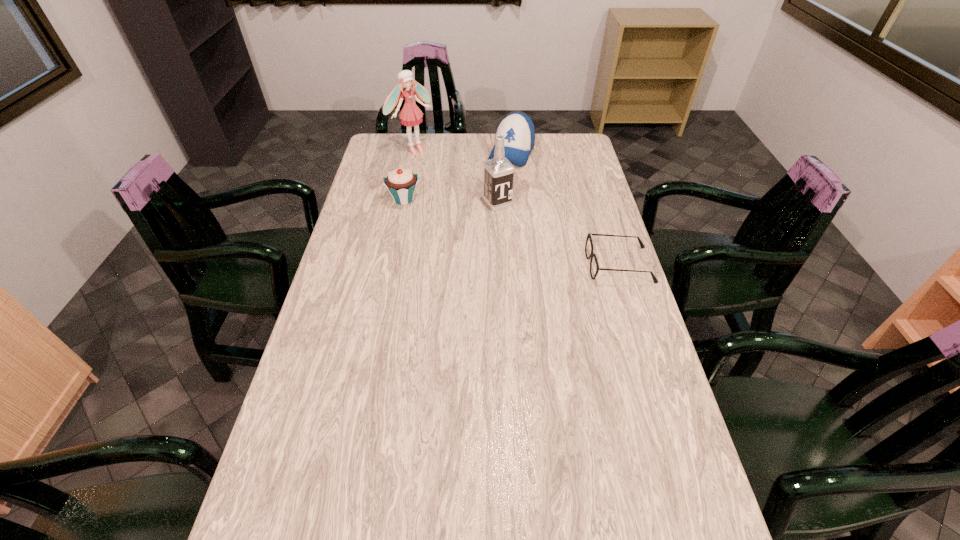
The height and width of the screenshot is (540, 960). What are the coordinates of `free point between the doll and the spectacles` in the screenshot? It's located at (516, 207).

Locate an element on the screen. This screenshot has height=540, width=960. unoccupied position between the shortest object and the cupcake is located at coordinates (512, 232).

The width and height of the screenshot is (960, 540). What are the coordinates of `unoccupied position between the rightmost object and the cupcake` in the screenshot? It's located at (512, 232).

Locate an element on the screen. This screenshot has width=960, height=540. free space between the doll and the baseball cap is located at coordinates (463, 151).

Identify the location of object that is the fourth nearest to the baseball cap. This screenshot has width=960, height=540. (589, 235).

At what (x,y) coordinates should I click in order to perform the action: click on object that ranks as the second closest to the vodka. Please return your answer as a coordinate pair (x, y). The image size is (960, 540). Looking at the image, I should click on (401, 183).

What are the coordinates of `free space in the image that satisfies the following two spatial constraints: 1. on the front side of the vodka; 2. on the left side of the doll` in the screenshot? It's located at (402, 203).

In order to click on free spot that satisfies the following two spatial constraints: 1. on the back side of the baseball cap; 2. on the right side of the cupcake in this screenshot , I will do `click(413, 152)`.

Image resolution: width=960 pixels, height=540 pixels. I want to click on vacant position in the image that satisfies the following two spatial constraints: 1. on the front side of the vodka; 2. with the lenses facing outward on the spectacles, so click(x=501, y=265).

I want to click on vacant point that satisfies the following two spatial constraints: 1. on the front side of the baseball cap; 2. with the lenses facing outward on the shortest object, so click(522, 265).